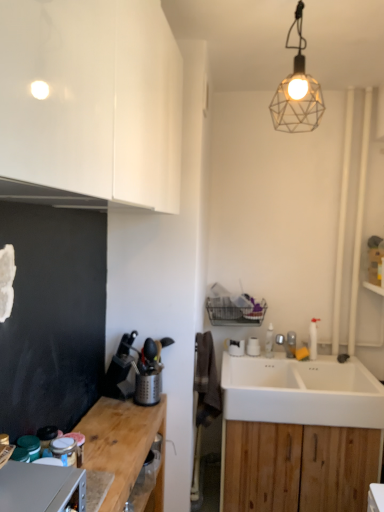
In order to face metallic grater at left, which appears as the third appliance when viewed from the front, should I rotate leftwards or rightwards?

To align with it, rotate left about 6.039°.

Identify the location of metallic grater at left, which appears as the third appliance when viewed from the front. (148, 387).

Measure the distance between matte glass jar at lower left, which ranks as the 2th appliance in back-to-front order, and camera.

matte glass jar at lower left, which ranks as the 2th appliance in back-to-front order, and camera are 3.88 feet apart from each other.

This screenshot has width=384, height=512. What do you see at coordinates (40, 487) in the screenshot?
I see `satin silver metallic fridge at lower left, which is the 1th appliance in front-to-back order` at bounding box center [40, 487].

The width and height of the screenshot is (384, 512). I want to click on white wood cabinet at lower right, acting as the 2th cabinetry starting from the left, so click(x=298, y=467).

Find the location of a particular element. The height and width of the screenshot is (512, 384). metallic wireframe lamp at upper center is located at coordinates (297, 91).

Identify the location of metallic grater at left, the first appliance from the back. (148, 387).

Measure the distance between white ceramic sink at lower right and wooden at left.

white ceramic sink at lower right is 27.84 inches away from wooden at left.

Is white ceramic sink at lower right far from wooden at left?

No, white ceramic sink at lower right is not far away from wooden at left.

From a real-world perspective, which object stands above the other?

white ceramic sink at lower right, from a real-world perspective.

From the image's perspective, is white ceramic sink at lower right below wooden at left?

No, from the image's perspective, white ceramic sink at lower right is not below wooden at left.

Can you confirm if white ceramic sink at lower right is positioned to the left of white wood cabinet at lower right, acting as the 2th cabinetry starting from the left?

No.

Are white ceramic sink at lower right and white wood cabinet at lower right, positioned as the 2th cabinetry in front-to-back order, beside each other?

No, white ceramic sink at lower right is not touching white wood cabinet at lower right, positioned as the 2th cabinetry in front-to-back order.

Choose the correct answer: Is white ceramic sink at lower right inside white wood cabinet at lower right, positioned as the 2th cabinetry in front-to-back order, or outside it?

white ceramic sink at lower right exists outside the volume of white wood cabinet at lower right, positioned as the 2th cabinetry in front-to-back order.

Locate an element on the screen. sink in front of the white wood cabinet at lower right, positioned as the 2th cabinetry in front-to-back order is located at coordinates (301, 391).

Is metallic grater at left, which appears as the third appliance when viewed from the front, far from white ceramic sink at lower right?

metallic grater at left, which appears as the third appliance when viewed from the front, is near white ceramic sink at lower right, not far away.

Find the location of a particular element. sink lying on the right of metallic grater at left, which appears as the third appliance when viewed from the front is located at coordinates (301, 391).

From the image's perspective, is metallic grater at left, the first appliance from the back, located above or below white ceramic sink at lower right?

Based on their image positions, metallic grater at left, the first appliance from the back, is located above white ceramic sink at lower right.

From a real-world perspective, which object stands above the other?

In real-world perspective, metallic grater at left, the first appliance from the back, is above.

Is metallic grater at left, which appears as the third appliance when viewed from the front, positioned with its back to white wood cabinet at lower right, which is counted as the 1th cabinetry, starting from the bottom?

metallic grater at left, which appears as the third appliance when viewed from the front, is not turned away from white wood cabinet at lower right, which is counted as the 1th cabinetry, starting from the bottom.

From the picture: Considering the sizes of objects metallic grater at left, the first appliance from the back, and white wood cabinet at lower right, positioned as the 1th cabinetry in back-to-front order, in the image provided, who is thinner, metallic grater at left, the first appliance from the back, or white wood cabinet at lower right, positioned as the 1th cabinetry in back-to-front order,?

metallic grater at left, the first appliance from the back, is thinner.

From the image's perspective, is metallic grater at left, the first appliance from the back, located above white wood cabinet at lower right, which is the second cabinetry from top to bottom?

Yes, from the image's perspective, metallic grater at left, the first appliance from the back, is on top of white wood cabinet at lower right, which is the second cabinetry from top to bottom.

In terms of height, does satin silver metallic fridge at lower left, which appears as the third appliance when viewed from the back, look taller or shorter compared to white wood cabinet at lower right, positioned as the 2th cabinetry in front-to-back order?

Considering their sizes, satin silver metallic fridge at lower left, which appears as the third appliance when viewed from the back, has less height than white wood cabinet at lower right, positioned as the 2th cabinetry in front-to-back order.

This screenshot has width=384, height=512. What are the coordinates of `cabinetry below the satin silver metallic fridge at lower left, which is the 1th appliance in front-to-back order (from the image's perspective)` in the screenshot? It's located at (298, 467).

Is satin silver metallic fridge at lower left, which appears as the third appliance when viewed from the back, in front of white wood cabinet at lower right, positioned as the 2th cabinetry in front-to-back order?

Yes, it is in front of white wood cabinet at lower right, positioned as the 2th cabinetry in front-to-back order.

Can you confirm if satin silver metallic fridge at lower left, which is the 1th appliance in front-to-back order, is smaller than white wood cabinet at lower right, acting as the 2th cabinetry starting from the left?

Indeed, satin silver metallic fridge at lower left, which is the 1th appliance in front-to-back order, has a smaller size compared to white wood cabinet at lower right, acting as the 2th cabinetry starting from the left.

Is metallic grater at left, the first appliance from the back, inside the boundaries of metallic wireframe lamp at upper center, or outside?

metallic grater at left, the first appliance from the back, is not enclosed by metallic wireframe lamp at upper center.

Is metallic grater at left, the first appliance from the back, taller or shorter than metallic wireframe lamp at upper center?

In the image, metallic grater at left, the first appliance from the back, appears to be shorter than metallic wireframe lamp at upper center.

Does metallic grater at left, which appears as the third appliance when viewed from the front, touch metallic wireframe lamp at upper center?

metallic grater at left, which appears as the third appliance when viewed from the front, and metallic wireframe lamp at upper center are clearly separated.

Consider the image. Which object is thinner, satin silver metallic fridge at lower left, which is the 1th appliance in front-to-back order, or glossy white cabinet at upper left, which is counted as the second cabinetry, starting from the back?

satin silver metallic fridge at lower left, which is the 1th appliance in front-to-back order.

At what (x,y) coordinates should I click in order to perform the action: click on the 3rd appliance below the glossy white cabinet at upper left, which ranks as the second cabinetry in bottom-to-top order (from a real-world perspective). Please return your answer as a coordinate pair (x, y). The image size is (384, 512). Looking at the image, I should click on (40, 487).

Is satin silver metallic fridge at lower left, which appears as the third appliance when viewed from the back, aimed at glossy white cabinet at upper left, the 1th cabinetry in the left-to-right sequence?

No, satin silver metallic fridge at lower left, which appears as the third appliance when viewed from the back, is not turned towards glossy white cabinet at upper left, the 1th cabinetry in the left-to-right sequence.

Is satin silver metallic fridge at lower left, which is the 1th appliance in front-to-back order, shorter than glossy white cabinet at upper left, the first cabinetry from the front?

Correct, satin silver metallic fridge at lower left, which is the 1th appliance in front-to-back order, is not as tall as glossy white cabinet at upper left, the first cabinetry from the front.

Find the location of a particular element. countertop lying on the left of white ceramic sink at lower right is located at coordinates (123, 444).

The width and height of the screenshot is (384, 512). What are the coordinates of `sink in front of the white wood cabinet at lower right, acting as the 2th cabinetry starting from the left` in the screenshot? It's located at (301, 391).

Looking at the image, which one is located closer to matte glass jar at lower left, which ranks as the 2th appliance in back-to-front order, glossy white cabinet at upper left, which is counted as the second cabinetry, starting from the back, or metallic grater at left, which appears as the third appliance when viewed from the front?

The object closer to matte glass jar at lower left, which ranks as the 2th appliance in back-to-front order, is metallic grater at left, which appears as the third appliance when viewed from the front.

Considering their positions, is white ceramic sink at lower right positioned closer to white wood cabinet at lower right, positioned as the 2th cabinetry in front-to-back order, than glossy white cabinet at upper left, the second cabinetry positioned from the right?

white ceramic sink at lower right is positioned closer to the anchor white wood cabinet at lower right, positioned as the 2th cabinetry in front-to-back order.

Looking at the image, which one is located further to white ceramic sink at lower right, metallic wireframe lamp at upper center or matte glass jar at lower left, positioned as the 2th appliance in front-to-back order?

The object further to white ceramic sink at lower right is metallic wireframe lamp at upper center.

Which object lies nearer to the anchor point metallic wireframe lamp at upper center, wooden at left or satin silver metallic fridge at lower left, which is the 1th appliance in front-to-back order?

Based on the image, wooden at left appears to be nearer to metallic wireframe lamp at upper center.

Based on their spatial positions, is white ceramic sink at lower right or metallic wireframe lamp at upper center closer to wooden at left?

white ceramic sink at lower right.

Estimate the real-world distances between objects in this image. Which object is closer to glossy white cabinet at upper left, the 1th cabinetry in the left-to-right sequence, matte glass jar at lower left, which ranks as the 2th appliance in back-to-front order, or white wood cabinet at lower right, which is the second cabinetry from top to bottom?

Based on the image, matte glass jar at lower left, which ranks as the 2th appliance in back-to-front order, appears to be nearer to glossy white cabinet at upper left, the 1th cabinetry in the left-to-right sequence.

From the image, which object appears to be nearer to metallic wireframe lamp at upper center, glossy white cabinet at upper left, the second cabinetry positioned from the right, or satin silver metallic fridge at lower left, which appears as the third appliance when viewed from the back?

Among the two, glossy white cabinet at upper left, the second cabinetry positioned from the right, is located nearer to metallic wireframe lamp at upper center.

When comparing their distances from white ceramic sink at lower right, does metallic wireframe lamp at upper center or wooden at left seem closer?

Based on the image, wooden at left appears to be nearer to white ceramic sink at lower right.

The height and width of the screenshot is (512, 384). Find the location of `countertop positioned between satin silver metallic fridge at lower left, which is the 1th appliance in front-to-back order, and matte glass jar at lower left, positioned as the 2th appliance in front-to-back order, from near to far`. countertop positioned between satin silver metallic fridge at lower left, which is the 1th appliance in front-to-back order, and matte glass jar at lower left, positioned as the 2th appliance in front-to-back order, from near to far is located at coordinates (123, 444).

Locate an element on the screen. countertop between metallic wireframe lamp at upper center and white wood cabinet at lower right, which appears as the 1th cabinetry when viewed from the right, in the up-down direction is located at coordinates (123, 444).

Where is `sink between metallic wireframe lamp at upper center and wooden at left vertically`? The width and height of the screenshot is (384, 512). sink between metallic wireframe lamp at upper center and wooden at left vertically is located at coordinates point(301,391).

Where is `cabinetry between metallic wireframe lamp at upper center and satin silver metallic fridge at lower left, which is the 1th appliance in front-to-back order, in the up-down direction`? The image size is (384, 512). cabinetry between metallic wireframe lamp at upper center and satin silver metallic fridge at lower left, which is the 1th appliance in front-to-back order, in the up-down direction is located at coordinates (90, 104).